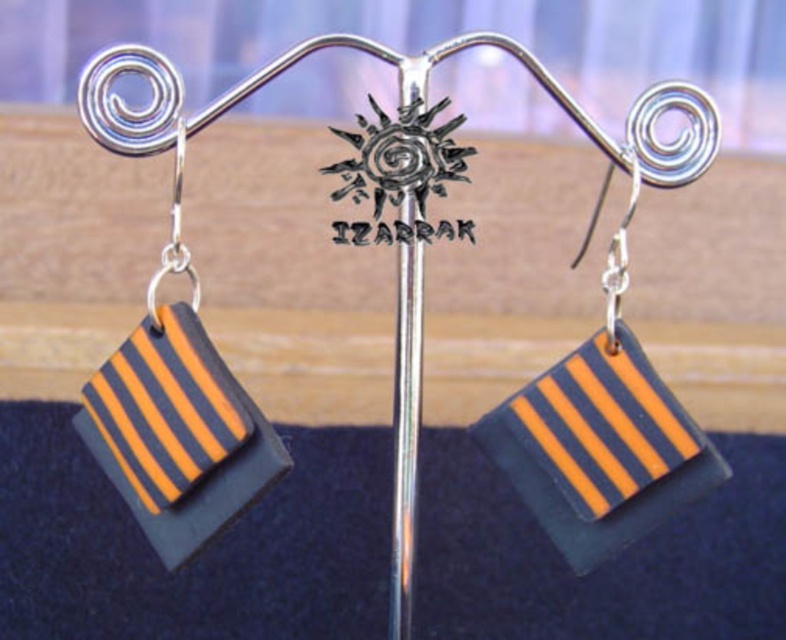
Question: Is orange matte rectangular earring at center positioned before orange matte rectangular earring at left?

Choices:
 (A) no
 (B) yes

Answer: (A)

Question: Is orange matte rectangular earring at center thinner than orange matte rectangular earring at left?

Choices:
 (A) yes
 (B) no

Answer: (B)

Question: Which of the following is the closest to the observer?

Choices:
 (A) (689, 451)
 (B) (175, 410)

Answer: (A)

Question: Which point is farther to the camera?

Choices:
 (A) (248, 401)
 (B) (594, 550)

Answer: (B)

Question: Can you confirm if orange matte rectangular earring at center is positioned to the left of orange matte rectangular earring at left?

Choices:
 (A) yes
 (B) no

Answer: (B)